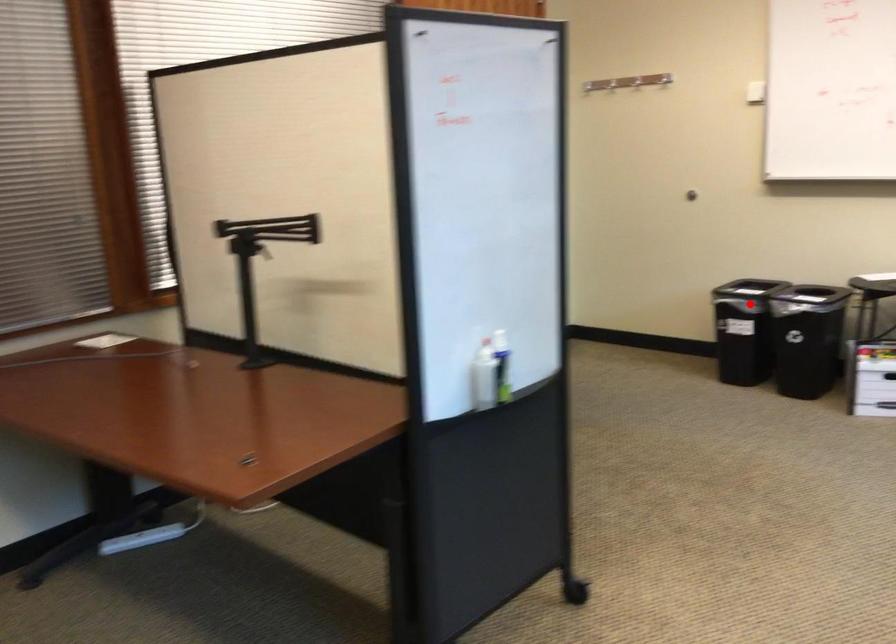
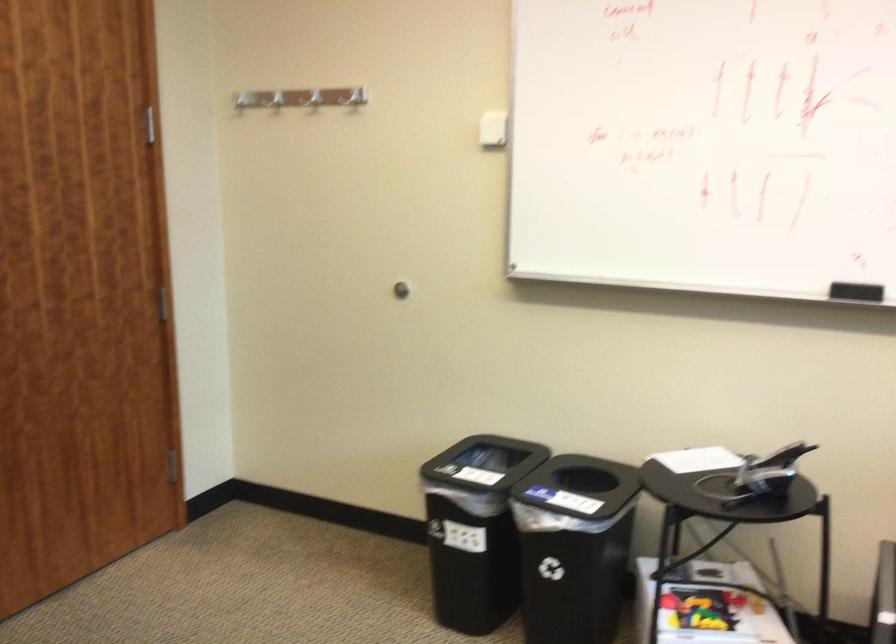
Locate, in the second image, the point that corresponds to the highlighted location in the first image.

(574, 547)